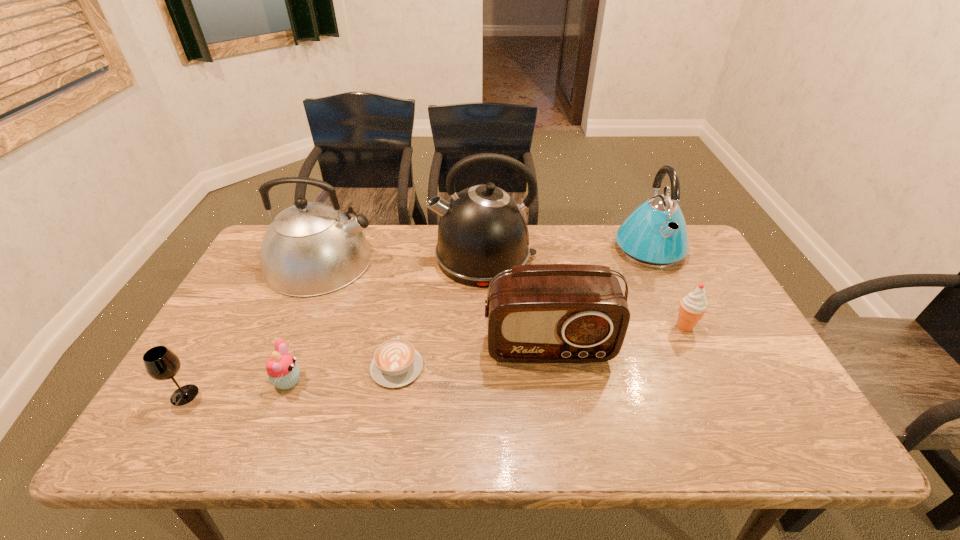
Find the location of a particular element. The image size is (960, 540). vacant space located 0.100m on the side of the shortest object with the handle is located at coordinates coord(405,317).

The image size is (960, 540). Find the location of `kettle positioned at the left edge`. kettle positioned at the left edge is located at coordinates (311, 248).

At what (x,y) coordinates should I click in order to perform the action: click on wineglass that is positioned at the left edge. Please return your answer as a coordinate pair (x, y). Looking at the image, I should click on (160, 363).

The image size is (960, 540). What are the coordinates of `kettle situated at the right edge` in the screenshot? It's located at (655, 235).

Identify the location of icecream located at the right edge. (693, 306).

The width and height of the screenshot is (960, 540). In order to click on object located in the far left corner section of the desktop in this screenshot , I will do `click(311, 248)`.

Where is `object present at the far right corner`? The width and height of the screenshot is (960, 540). object present at the far right corner is located at coordinates (655, 235).

Image resolution: width=960 pixels, height=540 pixels. I want to click on vacant space at the far edge, so click(540, 225).

You are a GUI agent. You are given a task and a screenshot of the screen. Output one action in this format:
    pyautogui.click(x=<x>, y=<y>)
    Task: Click on the free region at the near edge of the desktop
    
    Given the screenshot: What is the action you would take?
    pyautogui.click(x=424, y=427)

This screenshot has height=540, width=960. I want to click on free point at the left edge, so click(x=251, y=286).